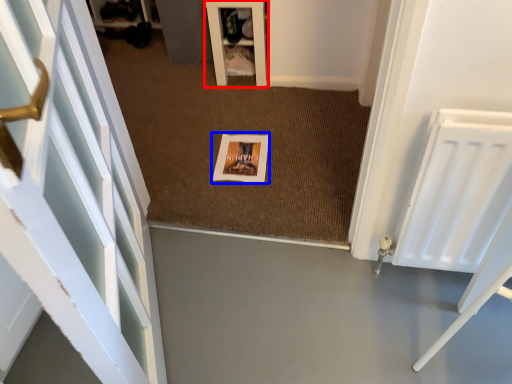
Question: Which of the following is the closest to the observer, furniture (highlighted by a red box) or picture frame (highlighted by a blue box)?

Choices:
 (A) furniture
 (B) picture frame

Answer: (B)